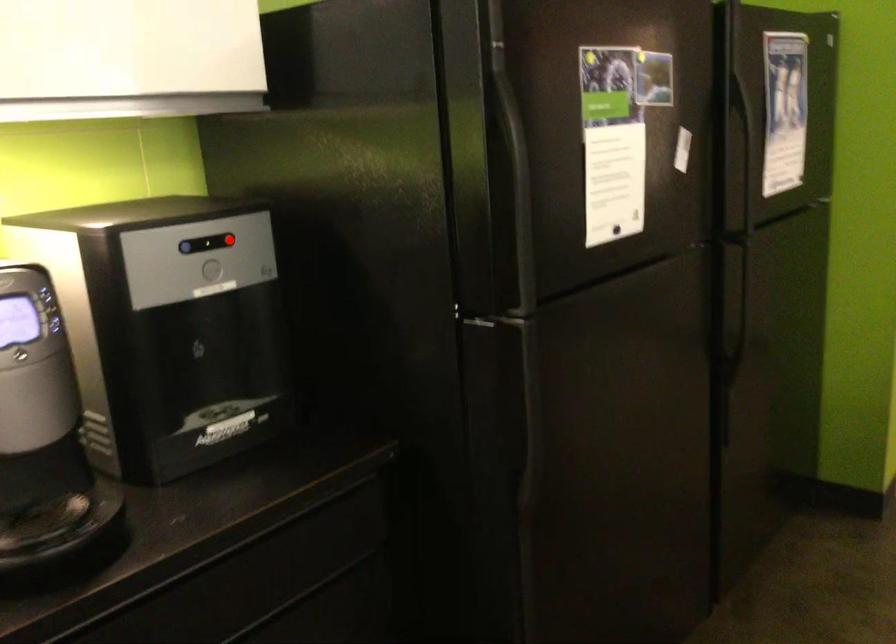
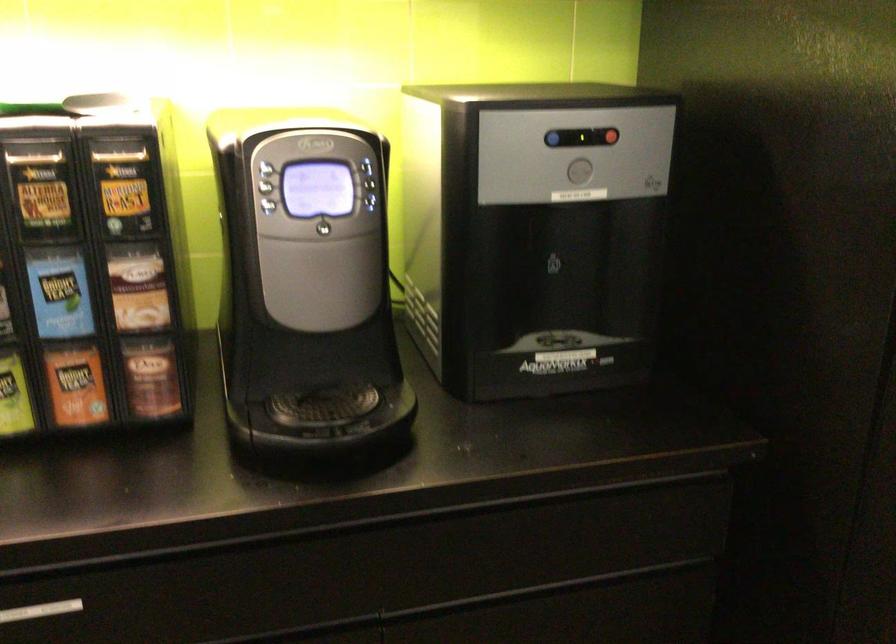
The point at the highlighted location is marked in the first image. Where is the corresponding point in the second image?

(612, 136)